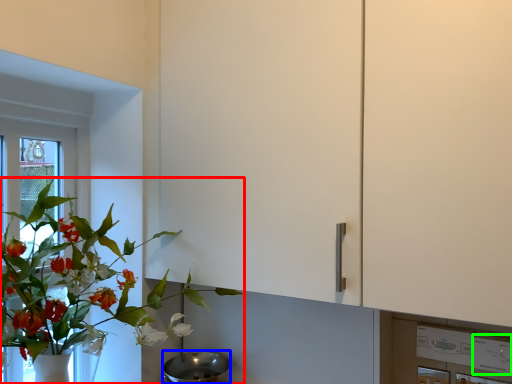
Question: Considering the real-world distances, which object is closest to houseplant (highlighted by a red box)? mixing bowl (highlighted by a blue box) or appliance (highlighted by a green box).

Choices:
 (A) mixing bowl
 (B) appliance

Answer: (A)